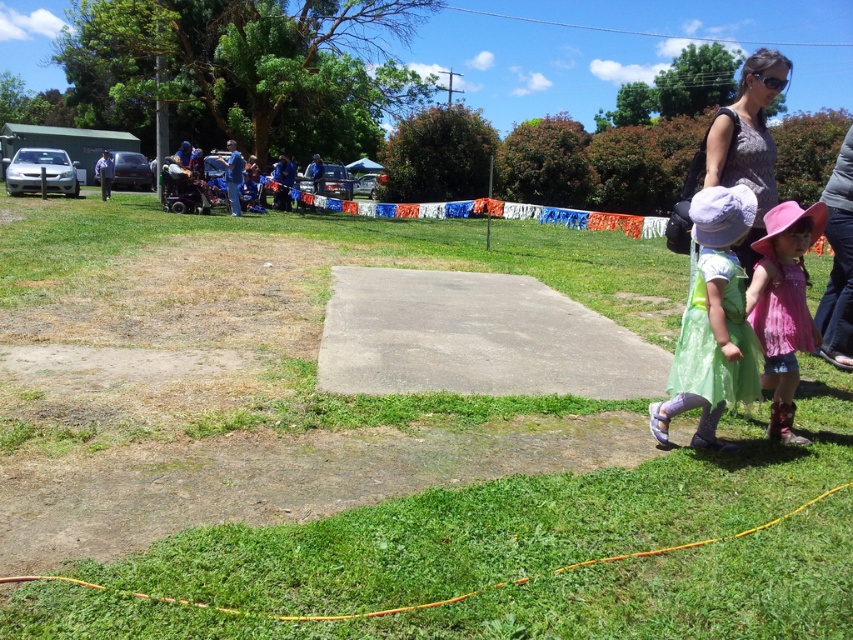
Who is positioned more to the right, pastel green dress at right or pink fabric dress at lower right?

From the viewer's perspective, pink fabric dress at lower right appears more on the right side.

Does point (672, 372) lie behind point (779, 291)?

That is False.

This screenshot has height=640, width=853. What do you see at coordinates (712, 323) in the screenshot?
I see `pastel green dress at right` at bounding box center [712, 323].

Where is `pastel green dress at right`? This screenshot has height=640, width=853. pastel green dress at right is located at coordinates (712, 323).

Is pastel green dress at right to the right of pink fabric dress at right from the viewer's perspective?

No, pastel green dress at right is not to the right of pink fabric dress at right.

Who is more forward, (704, 362) or (845, 157)?

Point (704, 362) is more forward.

Is point (733, 380) behind point (846, 256)?

No, (733, 380) is in front of (846, 256).

Locate an element on the screen. pastel green dress at right is located at coordinates (712, 323).

Is pastel green dress at right closer to camera compared to matte gray shirt at upper right?

Yes, pastel green dress at right is in front of matte gray shirt at upper right.

Which is below, pastel green dress at right or matte gray shirt at upper right?

pastel green dress at right

Describe the element at coordinates (712, 323) in the screenshot. I see `pastel green dress at right` at that location.

The image size is (853, 640). I want to click on pastel green dress at right, so click(712, 323).